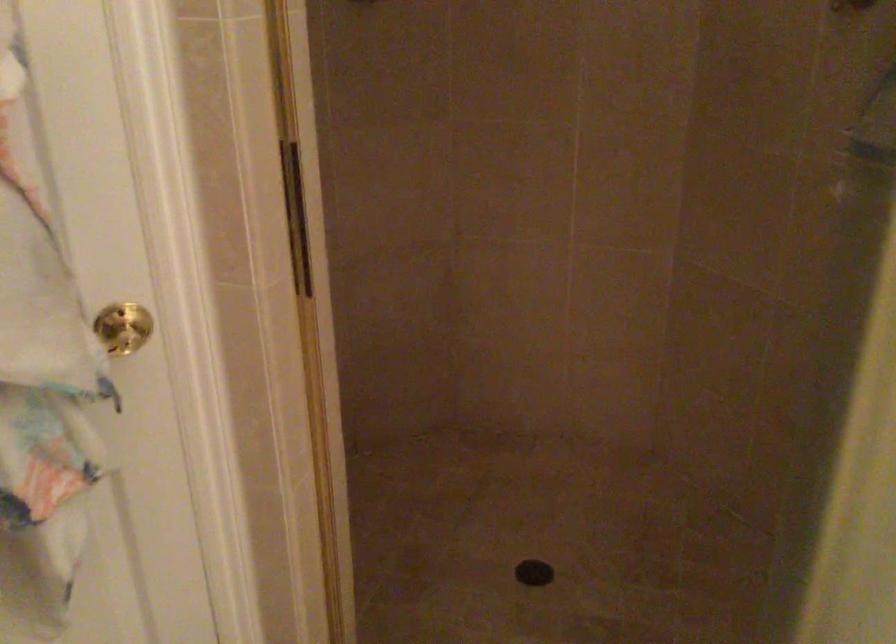
Image resolution: width=896 pixels, height=644 pixels. I want to click on brass door knob, so click(123, 328).